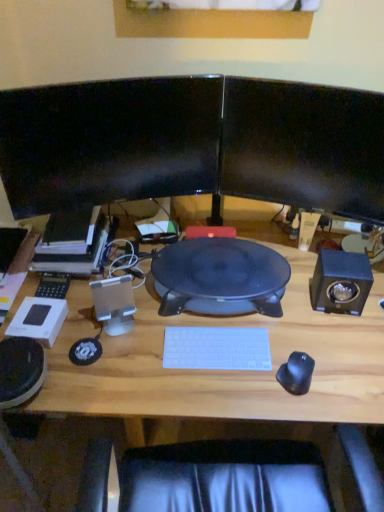
The height and width of the screenshot is (512, 384). In order to click on unoccupied space behind satin black speaker at right, which ranks as the 1th speaker in right-to-left order in this screenshot , I will do `click(304, 259)`.